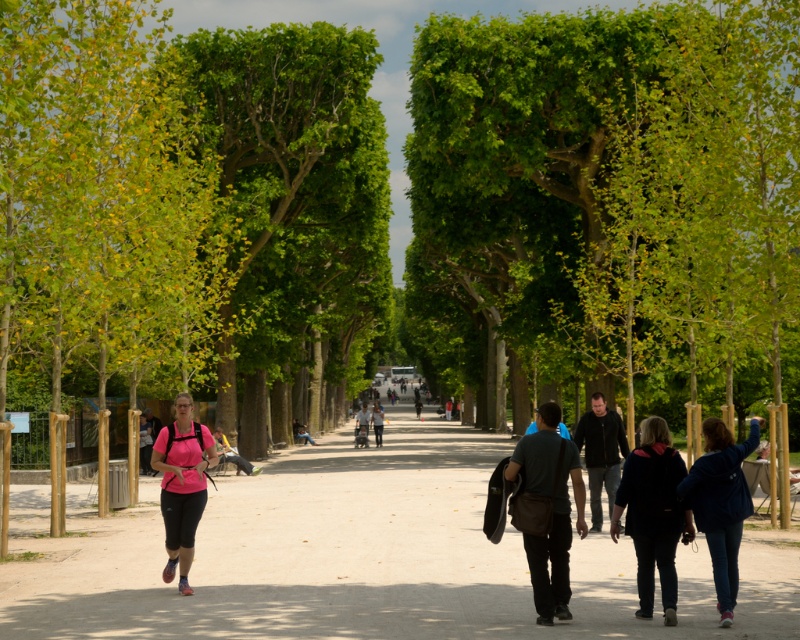
How far apart are sandy dirt path at center and dark gray fabric jacket at center?

sandy dirt path at center is 11.48 meters from dark gray fabric jacket at center.

Which is more to the left, sandy dirt path at center or dark gray fabric jacket at center?

From the viewer's perspective, sandy dirt path at center appears more on the left side.

Does point (776, 625) lie in front of point (576, 452)?

That is True.

Where is `sandy dirt path at center`? The image size is (800, 640). sandy dirt path at center is located at coordinates (358, 556).

Who is taller, dark gray fabric jacket at center or dark brown leather jacket at center?

Standing taller between the two is dark brown leather jacket at center.

Which is above, dark gray fabric jacket at center or dark brown leather jacket at center?

dark gray fabric jacket at center

Where is `dark gray fabric jacket at center`? Image resolution: width=800 pixels, height=640 pixels. dark gray fabric jacket at center is located at coordinates (552, 508).

Is the position of green leafy tree at center more distant than that of dark gray jacket at center?

No, green leafy tree at center is in front of dark gray jacket at center.

Is green leafy tree at center bigger than dark gray jacket at center?

Yes, green leafy tree at center is bigger than dark gray jacket at center.

The height and width of the screenshot is (640, 800). What are the coordinates of `green leafy tree at center` in the screenshot? It's located at (289, 220).

Image resolution: width=800 pixels, height=640 pixels. What are the coordinates of `green leafy tree at center` in the screenshot? It's located at (289, 220).